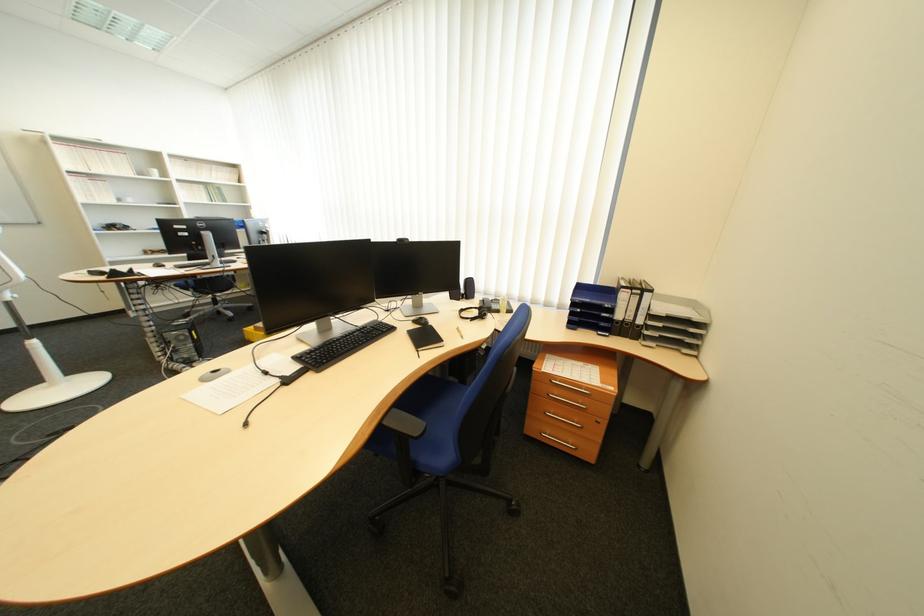
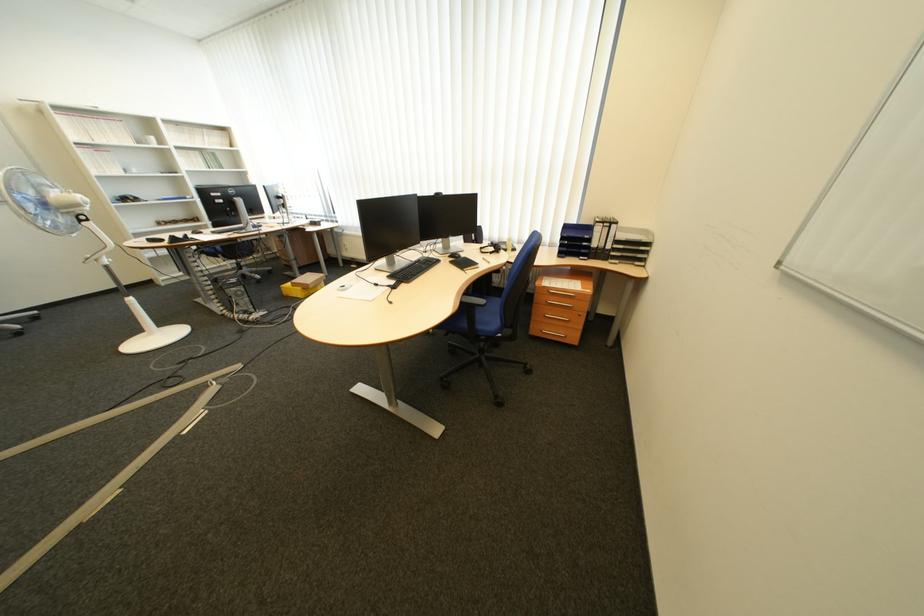
The point at (627, 286) is marked in the first image. Where is the corresponding point in the second image?

(604, 225)